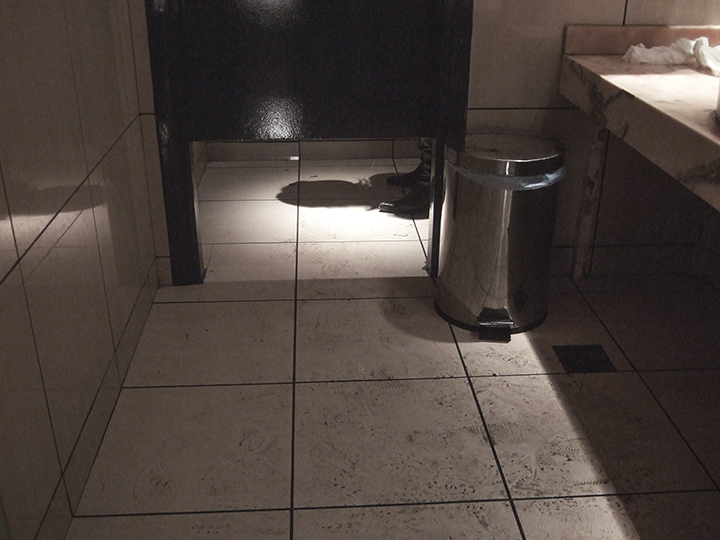
Identify the location of trash can liner bag. Image resolution: width=720 pixels, height=540 pixels. (531, 182).